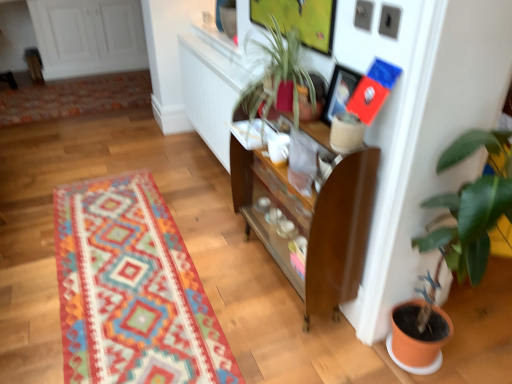
Locate an element on the screen. free space behind multicolored woven rug at center, positioned as the 1th mat in bottom-to-top order is located at coordinates (142, 164).